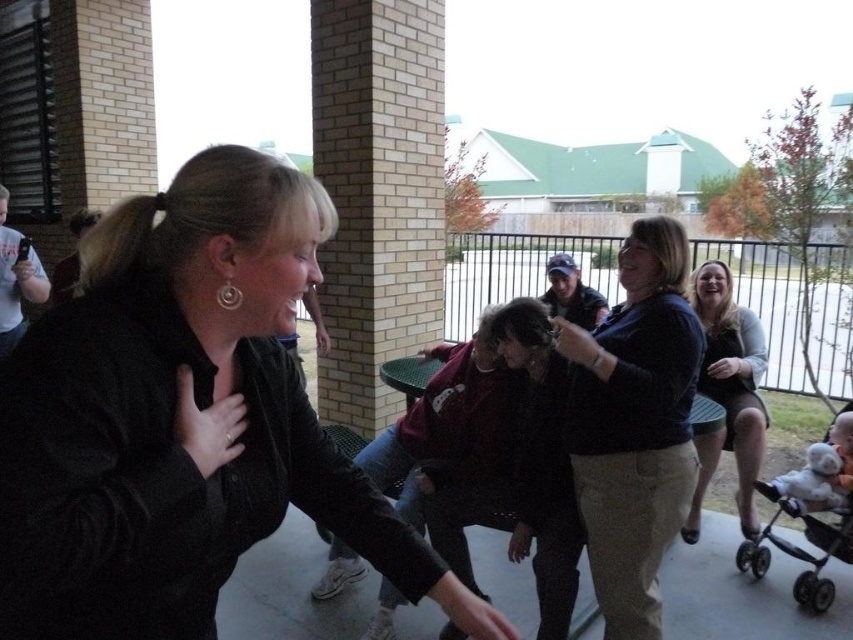
You are at the gathering and want to place a small gift under the white plush toy at lower right. Is there enough space there since there is a black plastic baby carriage at lower right already present?

The black plastic baby carriage at lower right is located below the white plush toy at lower right, so placing the gift under the white plush toy at lower right would be possible as the carriage is beneath it, creating space underneath the toy.